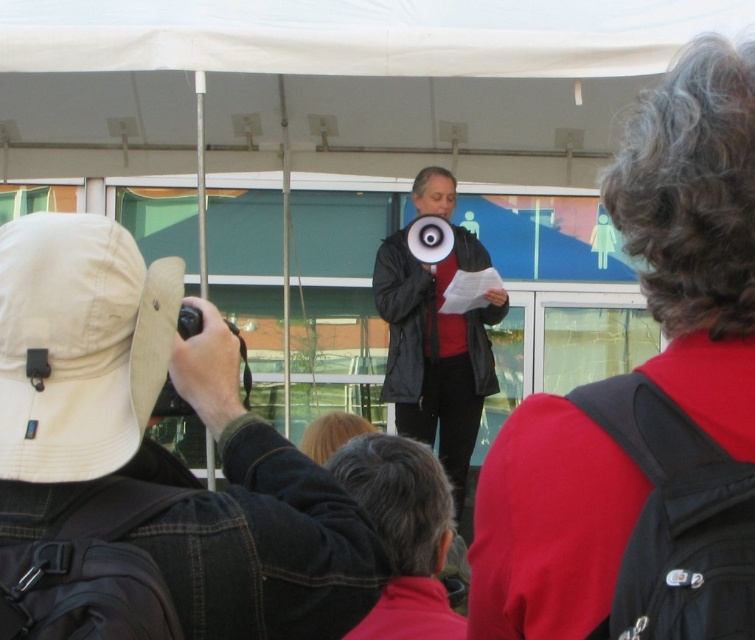
Between point (140, 332) and point (399, 429), which one is positioned in front?

Point (140, 332) is in front.

Does point (176, 317) lie in front of point (464, 260)?

Yes, point (176, 317) is closer to viewer.

You are a GUI agent. You are given a task and a screenshot of the screen. Output one action in this format:
    pyautogui.click(x=<x>, y=<y>)
    Task: Click on the tan fabric hat at upper left
    
    Given the screenshot: What is the action you would take?
    pyautogui.click(x=149, y=465)

I want to click on tan fabric hat at upper left, so click(x=149, y=465).